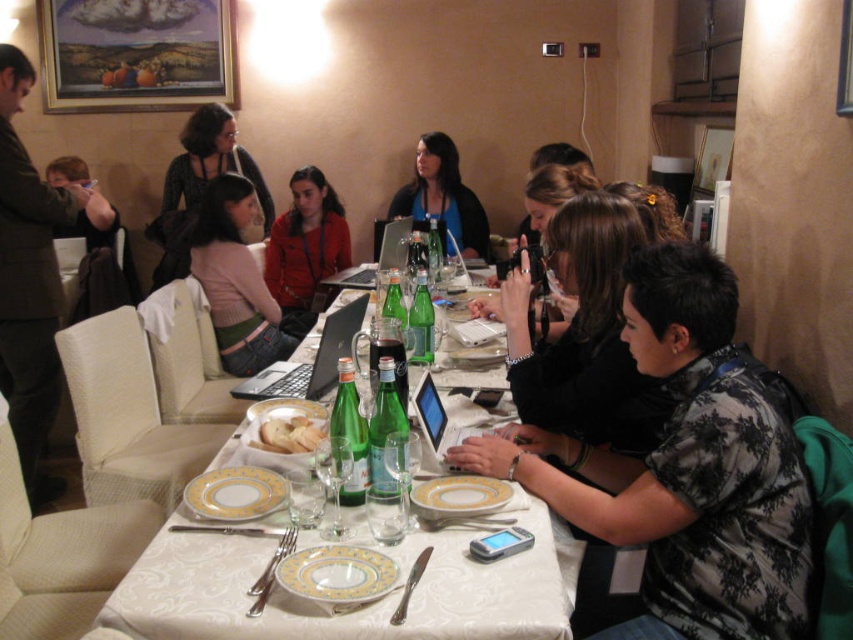
Looking at this image, you are sitting at the white glossy table at center and want to place your matte black laptop at center on the table. Can you reach it without moving your chair?

The white glossy table at center is closer to the viewer than the matte black laptop at center, so you can easily reach the matte black laptop at center without moving your chair.